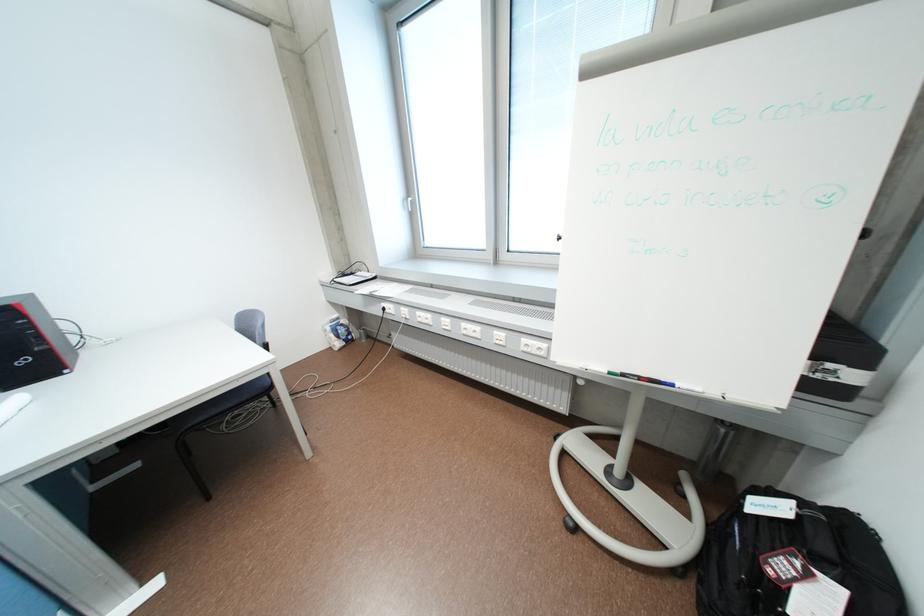
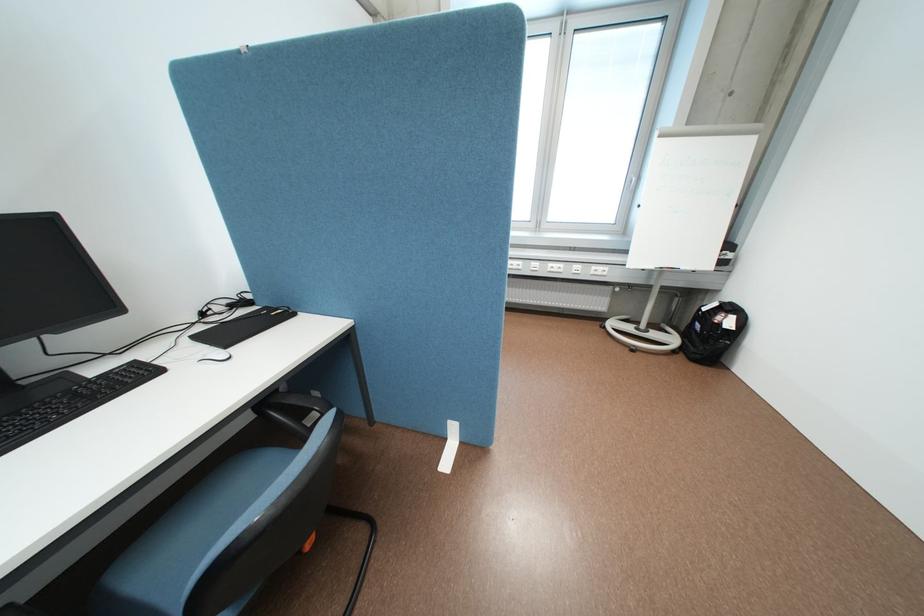
Question: The images are taken continuously from a first-person perspective. In which direction are you moving?

Choices:
 (A) Left
 (B) Right
 (C) Forward
 (D) Backward

Answer: (A)